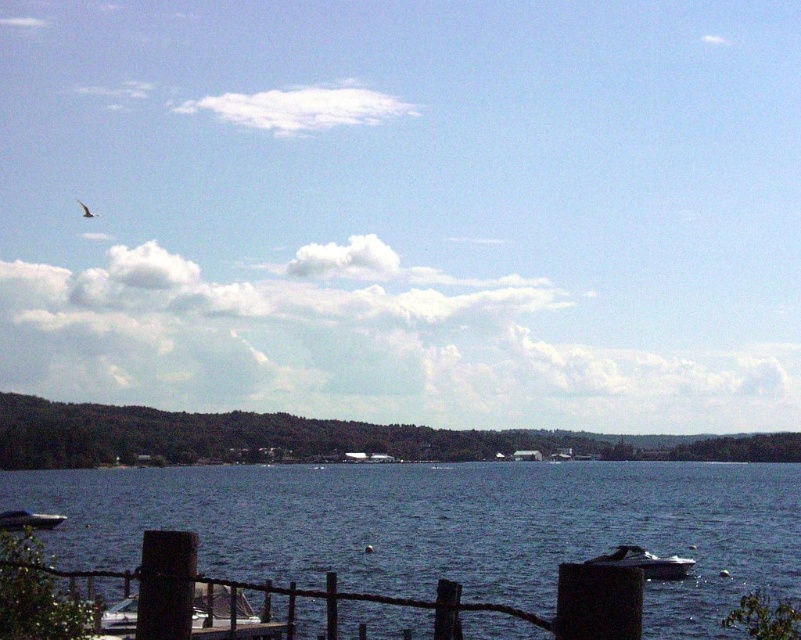
You are standing on the wooden dock and want to board one of the boats. Which boat is shorter in height between the shiny silver boat at lower right and the metallic blue boat at lower left?

The shiny silver boat at lower right has a lesser height compared to the metallic blue boat at lower left, so the shiny silver boat at lower right is shorter.